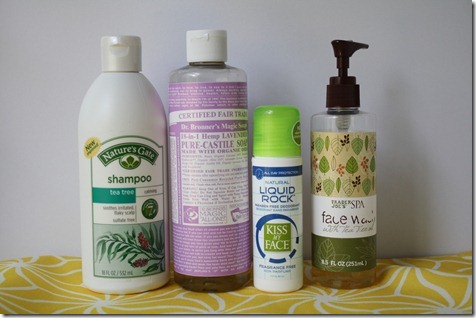
Identify the location of cream colored shampoo bottle. This screenshot has width=476, height=318. (114, 104).